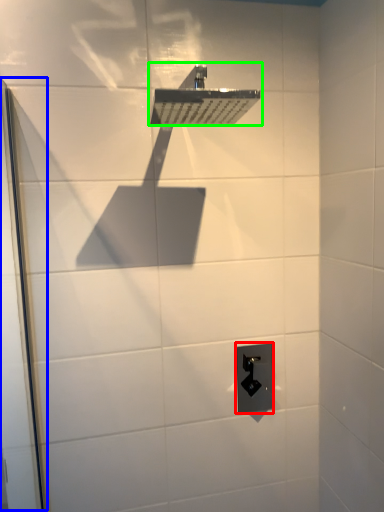
Question: Considering the real-world distances, which object is closest to electric outlet (highlighted by a red box)? screen door (highlighted by a blue box) or shower (highlighted by a green box).

Choices:
 (A) screen door
 (B) shower

Answer: (A)